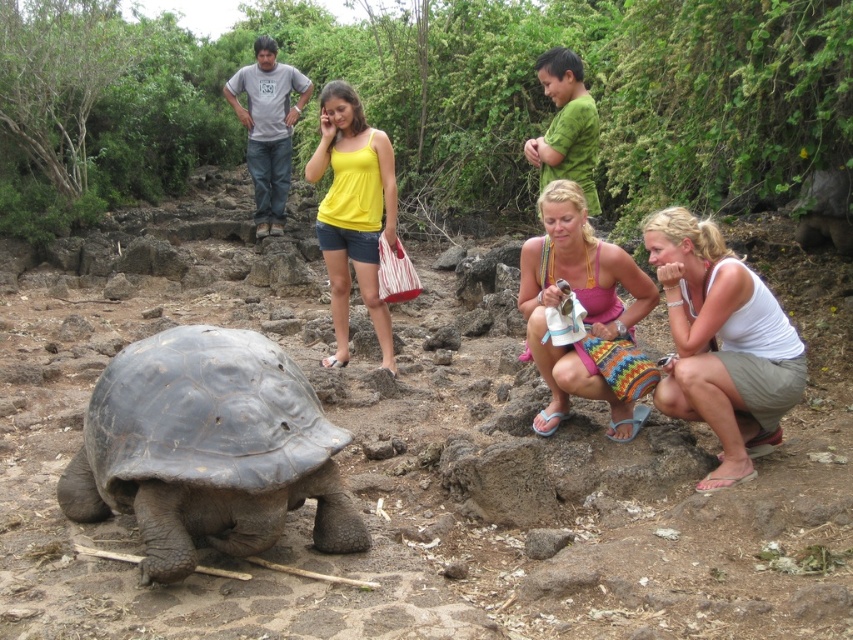
You are a photographer setting up a shot in this outdoor scene. You have two items to place in the frame for a composition. The white cotton tank top at lower right and the pink knitted skirt at lower center. Which item is closer to the camera?

The white cotton tank top at lower right is closer to the camera because it is in front of the pink knitted skirt at lower center.